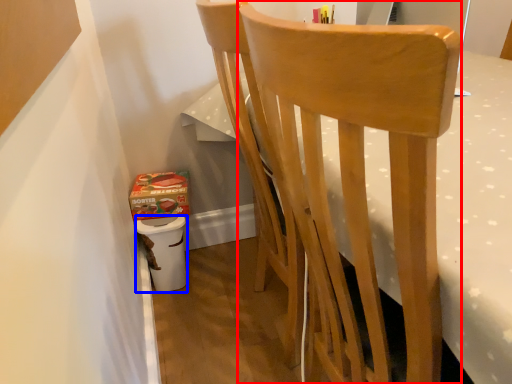
Question: Which object appears closest to the camera in this image, chair (highlighted by a red box) or potty (highlighted by a blue box)?

Choices:
 (A) chair
 (B) potty

Answer: (A)